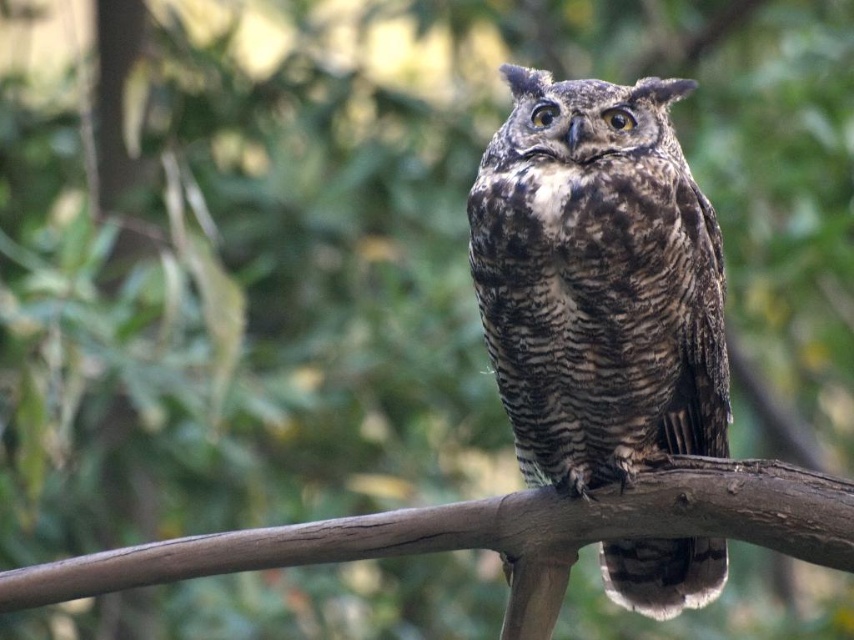
You are a birdwatcher trying to observe the brown speckled owl at center. From your vantage point, can you see the brown wood at center beneath the owl?

The brown speckled owl at center is positioned over brown wood at center, so yes, the brown wood at center is visible beneath the owl.

You are a photographer trying to capture the brown speckled owl at center. The camera is set up at point A. The owl is represented by point B at coordinates point (598, 282). If you want to move the camera closer to the owl, which direction should you move the camera? Please answer with either left, right, up, or down.

The brown speckled owl at center is represented by point B at coordinates point (598, 282). To move the camera closer to the owl, you should move the camera towards the center of the image since the owl is already at the center.

You are a photographer trying to capture a clear image of the brown speckled owl at center and the brown wood at center. Which object is closer to the camera lens?

The brown speckled owl at center is closer to the camera lens than the brown wood at center.